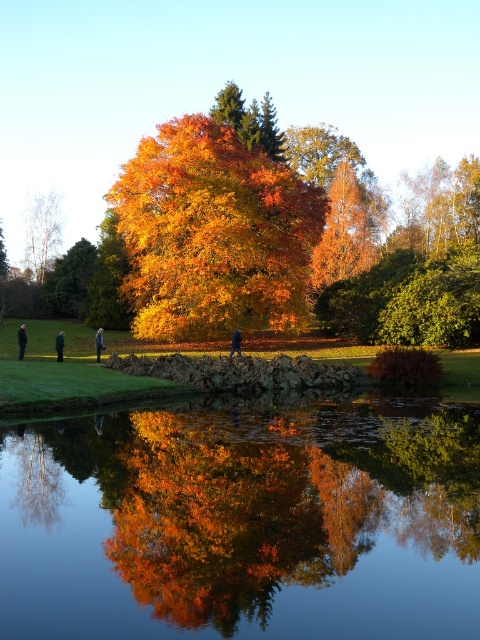
Is golden-orange foliage at center thinner than dark green fabric at left?

No, golden-orange foliage at center is not thinner than dark green fabric at left.

Who is positioned more to the right, golden-orange foliage at center or dark green fabric at left?

golden-orange foliage at center

Find the location of a particular element. This screenshot has width=480, height=640. golden-orange foliage at center is located at coordinates (213, 234).

Between point (348, 180) and point (21, 348), which one is positioned behind?

Point (348, 180)

Can you confirm if orange autumn leaves at center is positioned above black fabric person at lower left?

Correct, orange autumn leaves at center is located above black fabric person at lower left.

Measure the distance between point (334, 275) and camera.

A distance of 236.43 feet exists between point (334, 275) and camera.

Where is `orange autumn leaves at center`? This screenshot has width=480, height=640. orange autumn leaves at center is located at coordinates (348, 227).

Between point (276, 182) and point (24, 339), which one is positioned in front?

Point (24, 339)

Between golden-orange foliage at center and black fabric person at lower left, which one has more height?

golden-orange foliage at center

Locate an element on the screen. The image size is (480, 640). golden-orange foliage at center is located at coordinates (213, 234).